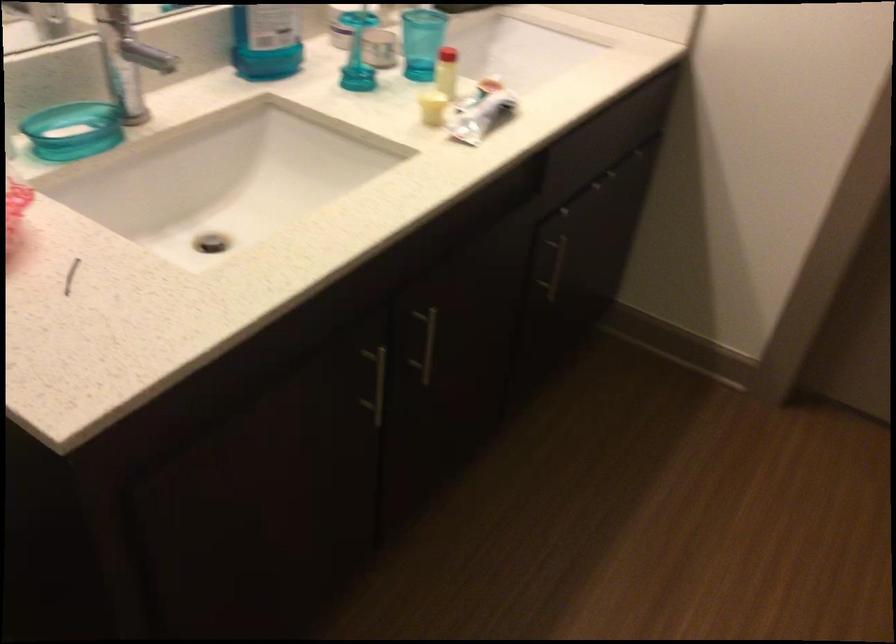
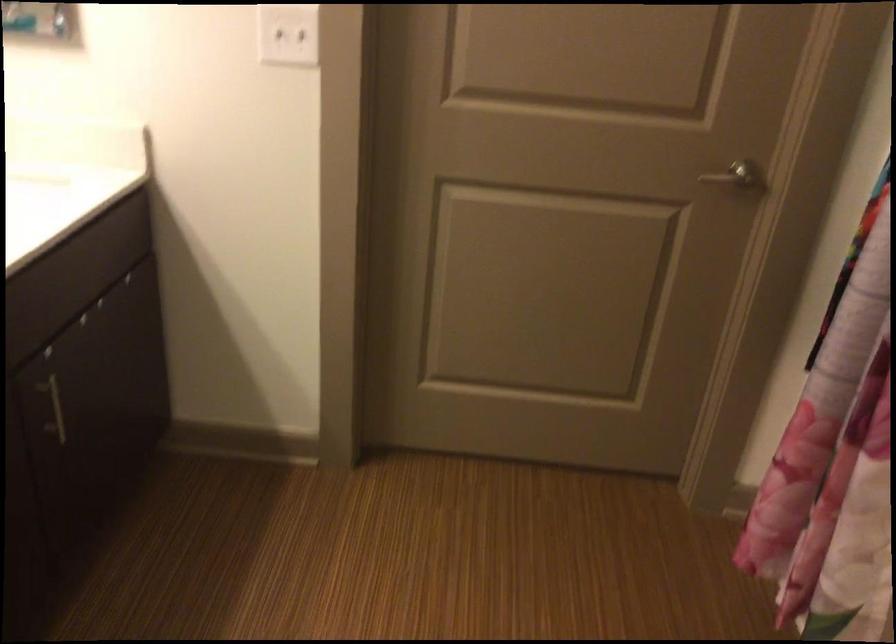
Find the pixel in the second image that matches [554,268] in the first image.

(54, 409)